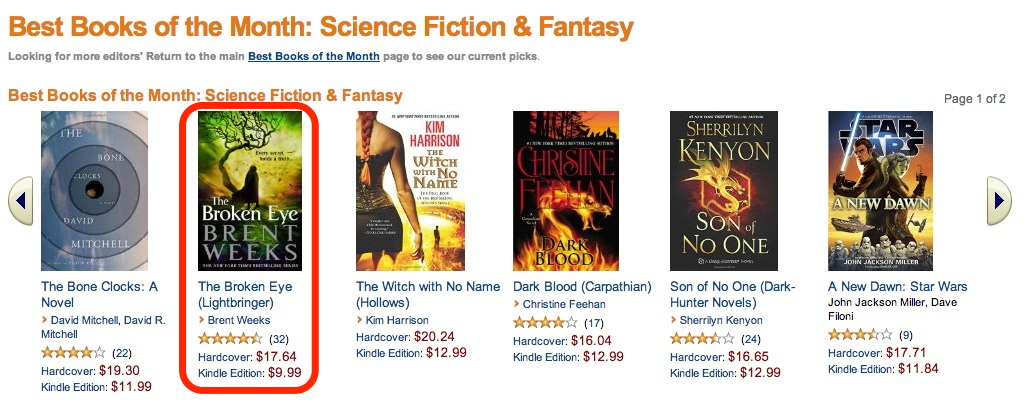
At what (x,y) coordinates should I click in order to perform the action: click on books. Please return your answer as a coordinate pair (x, y). Looking at the image, I should click on (135, 208), (242, 208), (412, 201), (545, 201), (713, 203), (873, 208).